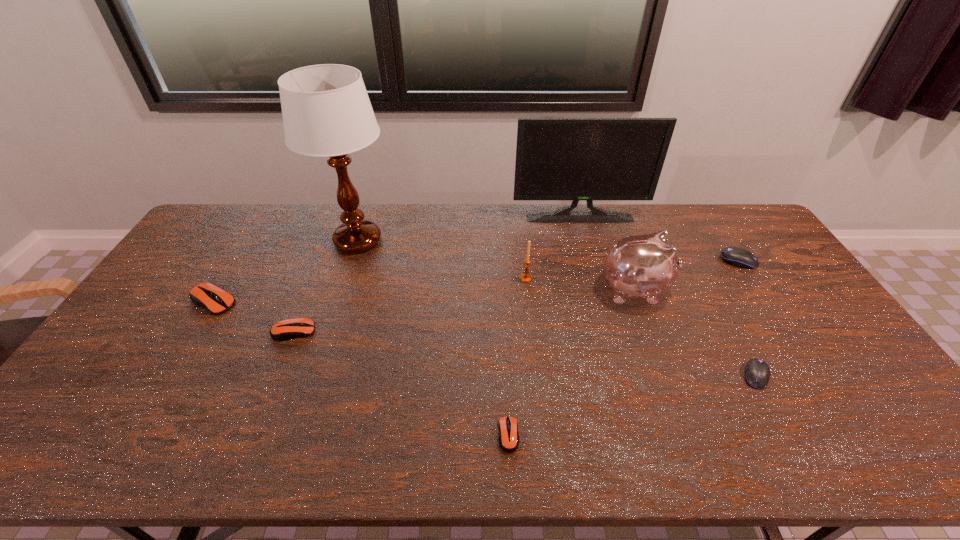
Locate an element on the screen. The width and height of the screenshot is (960, 540). vacant region located 0.120m on the back of the farther black computer mouse is located at coordinates (719, 231).

I want to click on vacant space situated 0.080m on the front of the seventh farthest object, so click(280, 366).

You are a GUI agent. You are given a task and a screenshot of the screen. Output one action in this format:
    pyautogui.click(x=<x>, y=<y>)
    Task: Click on the free point located 0.210m on the right of the second computer mouse from right to left
    
    Given the screenshot: What is the action you would take?
    pyautogui.click(x=850, y=375)

You are a GUI agent. You are given a task and a screenshot of the screen. Output one action in this format:
    pyautogui.click(x=<x>, y=<y>)
    Task: Click on the free region located on the left of the third computer mouse from right to left
    
    Given the screenshot: What is the action you would take?
    pyautogui.click(x=404, y=435)

This screenshot has height=540, width=960. What are the coordinates of `table lamp at the far edge` in the screenshot? It's located at (326, 111).

Identify the location of monitor that is at the far edge. (575, 159).

This screenshot has width=960, height=540. Find the location of `object that is at the near edge`. object that is at the near edge is located at coordinates (508, 426).

Where is `object situated at the left edge`? This screenshot has height=540, width=960. object situated at the left edge is located at coordinates (209, 296).

Find the location of a particular element. This screenshot has width=960, height=540. object at the right edge is located at coordinates (736, 256).

This screenshot has height=540, width=960. I want to click on vacant space at the far edge of the desktop, so click(x=507, y=234).